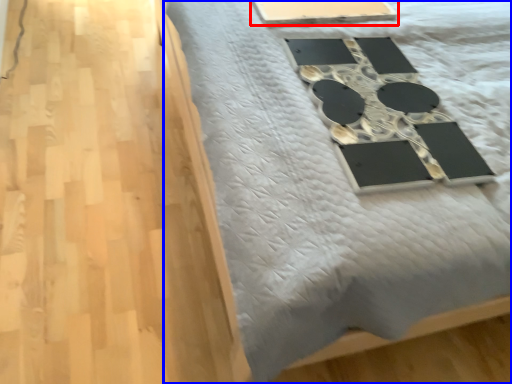
Question: Which object appears farthest to the camera in this image, table (highlighted by a red box) or furniture (highlighted by a blue box)?

Choices:
 (A) table
 (B) furniture

Answer: (A)